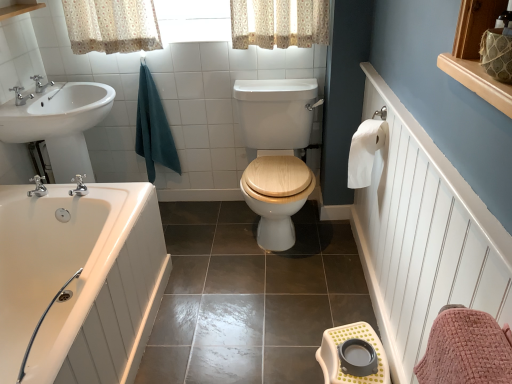
Question: Can you confirm if brushed metal faucet at upper left, the first tap when ordered from back to front, is bigger than wooden at center?

Choices:
 (A) yes
 (B) no

Answer: (B)

Question: Can you confirm if brushed metal faucet at upper left, the second tap viewed from the front, is smaller than wooden at center?

Choices:
 (A) no
 (B) yes

Answer: (B)

Question: Is wooden at center completely or partially inside brushed metal faucet at upper left, the first tap when ordered from back to front?

Choices:
 (A) no
 (B) yes

Answer: (A)

Question: Is brushed metal faucet at upper left, the first tap when ordered from back to front, at the right side of wooden at center?

Choices:
 (A) no
 (B) yes

Answer: (A)

Question: Considering the relative positions of brushed metal faucet at upper left, the first tap in the top-to-bottom sequence, and wooden at center in the image provided, is brushed metal faucet at upper left, the first tap in the top-to-bottom sequence, to the left of wooden at center from the viewer's perspective?

Choices:
 (A) yes
 (B) no

Answer: (A)

Question: Is brushed metal faucet at upper left, the second tap viewed from the front, positioned before wooden at center?

Choices:
 (A) yes
 (B) no

Answer: (B)

Question: Is white glossy sink at left surrounding white glossy bathtub at lower left?

Choices:
 (A) no
 (B) yes

Answer: (A)

Question: From a real-world perspective, is white glossy sink at left on top of white glossy bathtub at lower left?

Choices:
 (A) no
 (B) yes

Answer: (B)

Question: Can we say white glossy sink at left lies outside white glossy bathtub at lower left?

Choices:
 (A) yes
 (B) no

Answer: (A)

Question: Could you tell me if white glossy sink at left is turned towards white glossy bathtub at lower left?

Choices:
 (A) no
 (B) yes

Answer: (A)

Question: Is white glossy sink at left positioned in front of white glossy bathtub at lower left?

Choices:
 (A) no
 (B) yes

Answer: (A)

Question: Can you confirm if white glossy sink at left is shorter than white glossy bathtub at lower left?

Choices:
 (A) yes
 (B) no

Answer: (B)

Question: Is brushed metal faucet at upper left, the first tap when ordered from back to front, at the right side of white glossy sink at left?

Choices:
 (A) no
 (B) yes

Answer: (A)